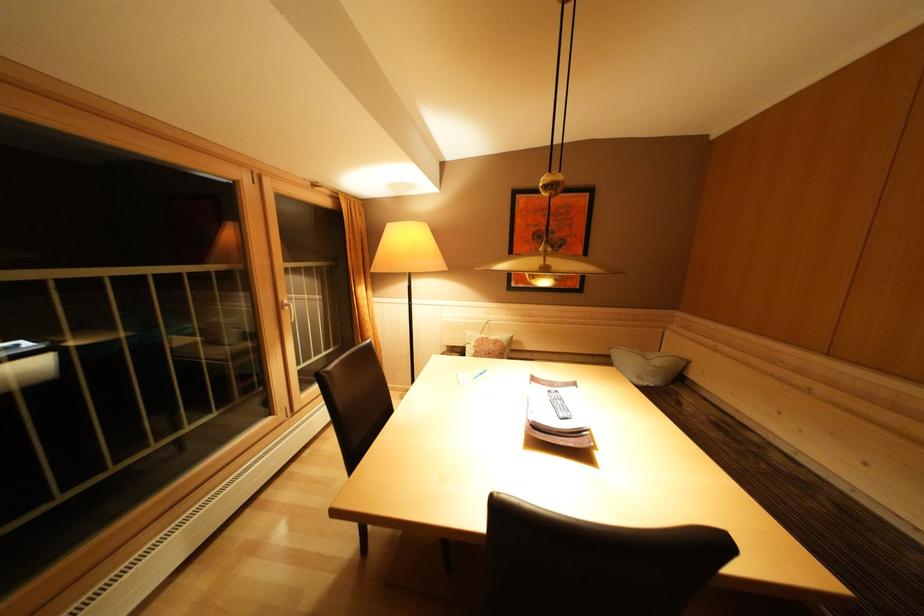
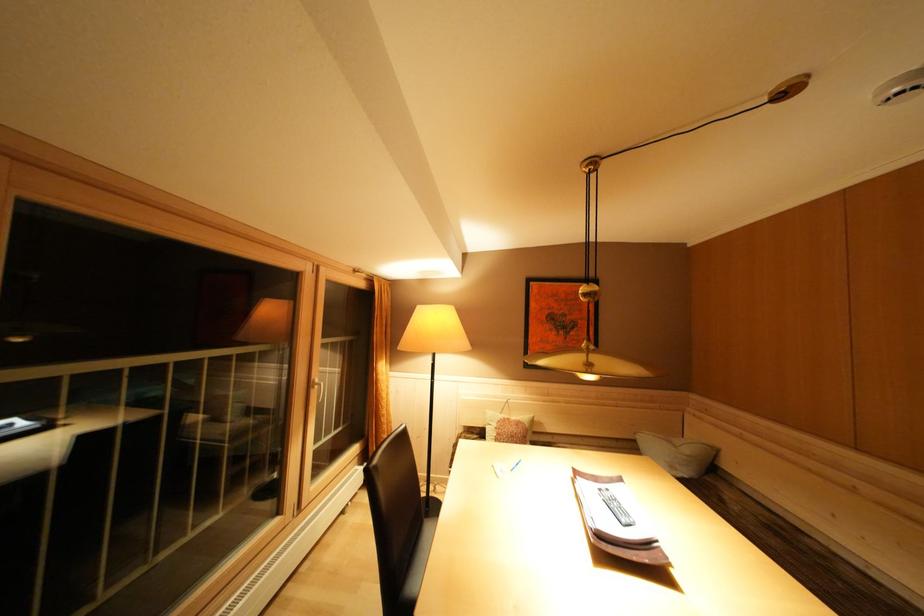
Where in the second image is the point corresponding to (x=700, y=397) from the first image?

(737, 490)